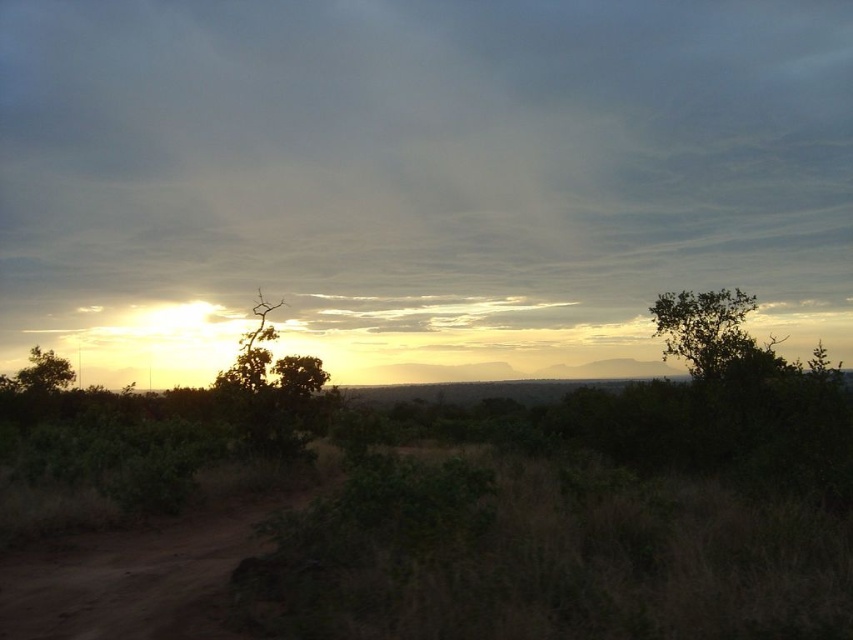
Question: Considering the relative positions of green leafy tree at right and green leafy tree at lower left in the image provided, where is green leafy tree at right located with respect to green leafy tree at lower left?

Choices:
 (A) below
 (B) above

Answer: (B)

Question: Which object is positioned farthest from the green leafy tree at right?

Choices:
 (A) brown dirt track at lower left
 (B) translucent white cloud at upper center
 (C) green leafy tree at lower left

Answer: (B)

Question: Can you confirm if green leafy tree at right is bigger than green leafy tree at lower left?

Choices:
 (A) yes
 (B) no

Answer: (B)

Question: Does translucent white cloud at upper center appear over brown dirt track at lower left?

Choices:
 (A) yes
 (B) no

Answer: (A)

Question: Considering the real-world distances, which object is closest to the green leafy tree at right?

Choices:
 (A) brown dirt track at lower left
 (B) translucent white cloud at upper center

Answer: (A)

Question: Which point is closer to the camera?

Choices:
 (A) translucent white cloud at upper center
 (B) brown dirt track at lower left
 (C) green leafy tree at lower left

Answer: (B)